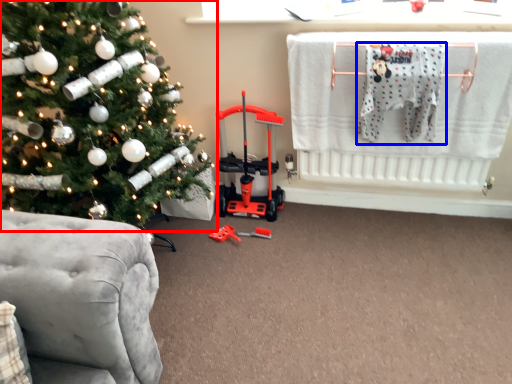
Question: Which of the following is the closest to the observer, christmas tree (highlighted by a red box) or baby clothe (highlighted by a blue box)?

Choices:
 (A) christmas tree
 (B) baby clothe

Answer: (A)